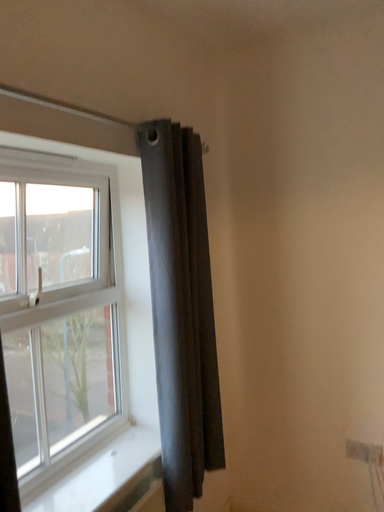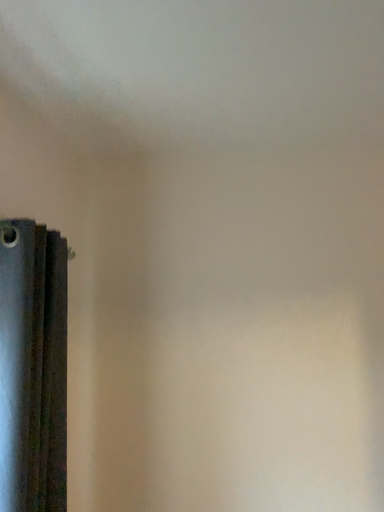
Question: How did the camera likely rotate when shooting the video?

Choices:
 (A) rotated downward
 (B) rotated upward

Answer: (B)